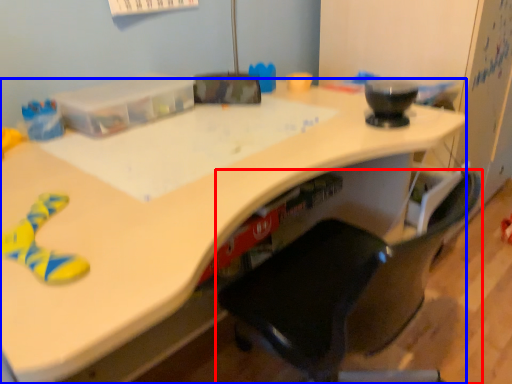
Question: Which of the following is the farthest to the observer, chair (highlighted by a red box) or desk (highlighted by a blue box)?

Choices:
 (A) chair
 (B) desk

Answer: (B)